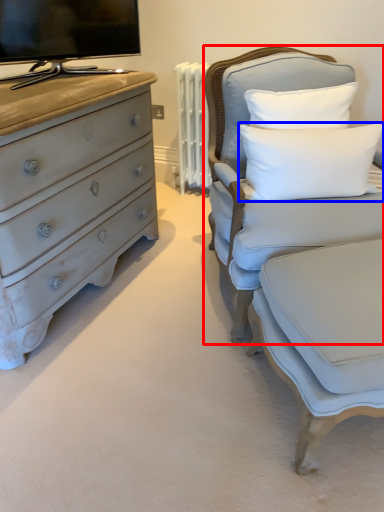
Question: Which of the following is the closest to the observer, chair (highlighted by a red box) or pillow (highlighted by a blue box)?

Choices:
 (A) chair
 (B) pillow

Answer: (A)